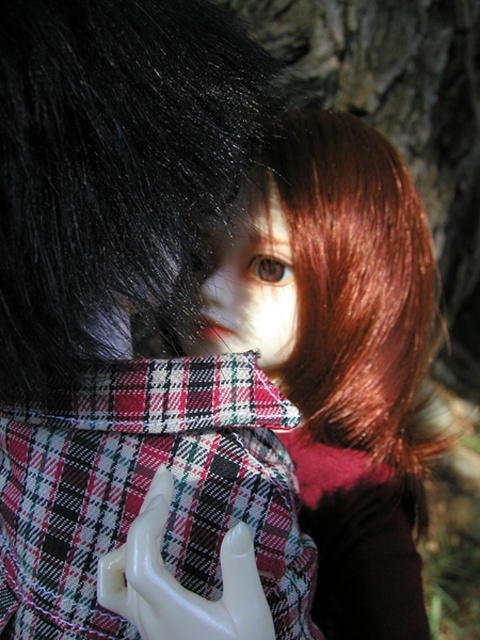
You are an artist trying to sketch the scene. You need to place the plaid fabric at center correctly. According to the coordinates provided, where exactly should you position it in your drawing?

The plaid fabric at center should be positioned at coordinates point (x=145, y=492) as specified.

You are a collector examining two dolls in an antique shop. You notice the plaid fabric at center and the white glossy hand at center. Which object is larger in size?

The plaid fabric at center is bigger than the white glossy hand at center.

You are a collector examining two dolls in an antique shop. You notice the black shiny hair at upper center and the plaid fabric at center. Which object is narrower in width?

The black shiny hair at upper center is thinner than the plaid fabric at center, so the black shiny hair at upper center is narrower in width.